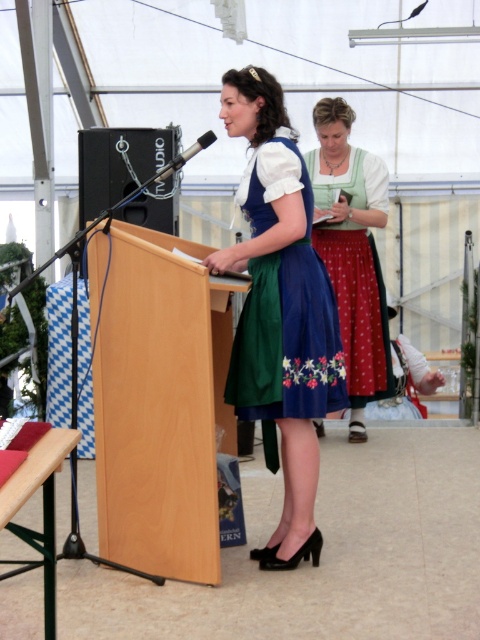
You are attending a cultural event and need to approach the speaker who is wearing the green satin dirndl at center. There is a beech wood podium at center in your way. Can you walk directly to the speaker without going around the podium?

The beech wood podium at center is closer to the viewer than the green satin dirndl at center, so you would need to go around the podium to reach the speaker.